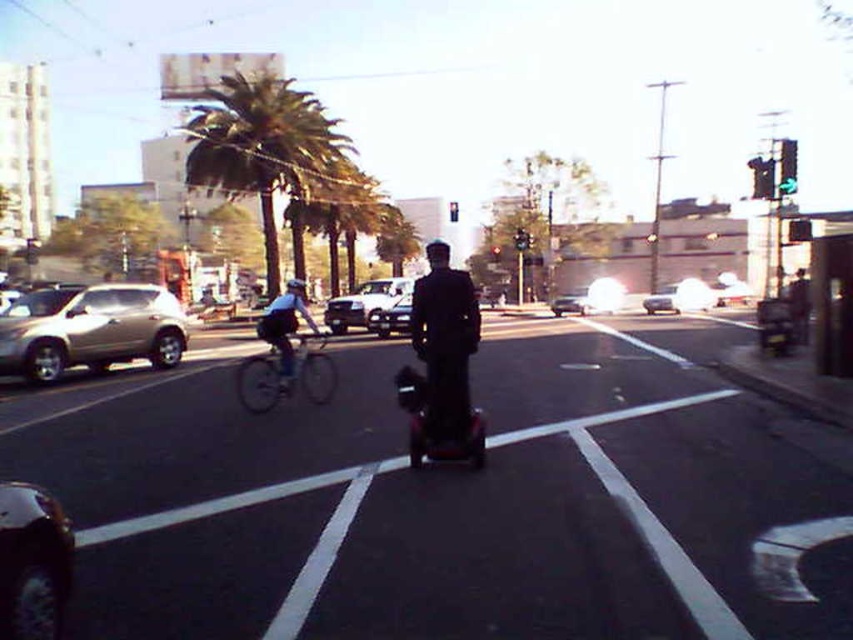
Does satin gold suv at left appear over silver metallic bicycle at center-left?

Correct, satin gold suv at left is located above silver metallic bicycle at center-left.

Does point (161, 355) lie in front of point (328, 337)?

Yes, it is.

Is point (184, 337) positioned before point (312, 401)?

That is False.

This screenshot has width=853, height=640. I want to click on satin gold suv at left, so click(x=90, y=330).

Is point (419, 426) more distant than point (386, 317)?

No, it is not.

This screenshot has height=640, width=853. I want to click on black glossy scooter at center, so click(x=439, y=419).

Between black matte hoverboard at center and white glossy sedan at center, which one appears on the left side from the viewer's perspective?

black matte hoverboard at center is more to the left.

Is point (136, 412) in front of point (663, 307)?

Yes, point (136, 412) is in front of point (663, 307).

Where is `black matte hoverboard at center`? black matte hoverboard at center is located at coordinates (456, 500).